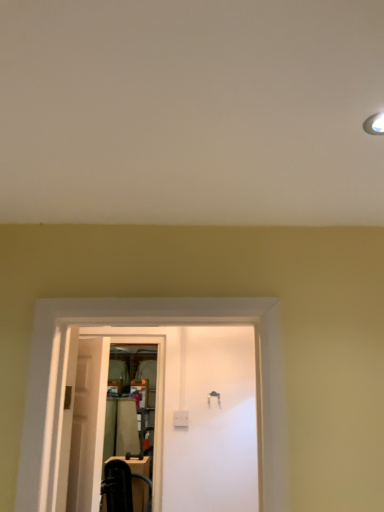
What do you see at coordinates (120, 485) in the screenshot?
I see `metallic black exercise machine at lower left` at bounding box center [120, 485].

What is the approximate width of metallic black exercise machine at lower left?

It is 16.79 inches.

Identify the location of metallic black exercise machine at lower left. This screenshot has height=512, width=384. (120, 485).

In order to click on metallic black exercise machine at lower left in this screenshot , I will do `click(120, 485)`.